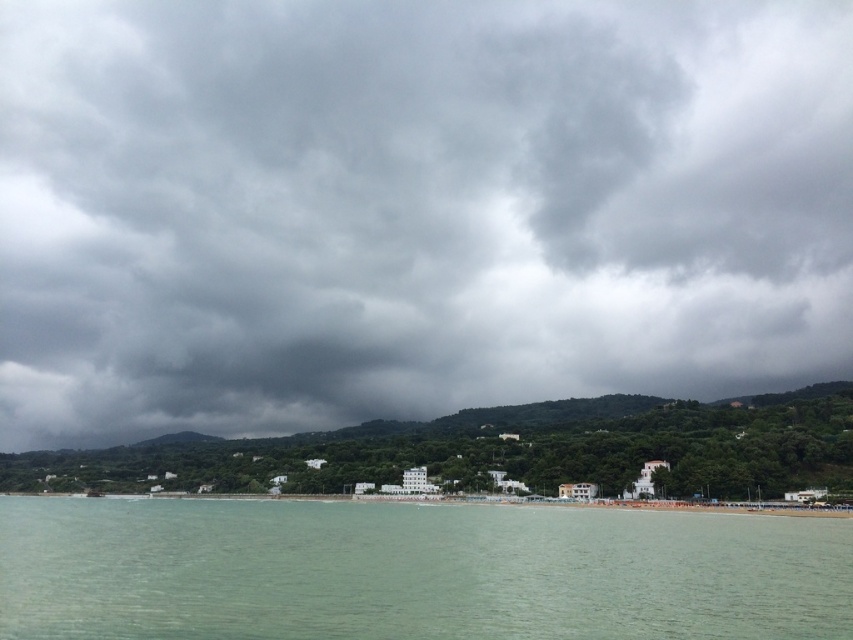
Question: Where is dark gray cloud at upper center located in relation to clear water at lower center in the image?

Choices:
 (A) above
 (B) below

Answer: (A)

Question: Which point is farther to the camera?

Choices:
 (A) clear water at lower center
 (B) dark gray cloud at upper center

Answer: (B)

Question: Does dark gray cloud at upper center appear on the right side of clear water at lower center?

Choices:
 (A) no
 (B) yes

Answer: (A)

Question: Is dark gray cloud at upper center behind clear water at lower center?

Choices:
 (A) yes
 (B) no

Answer: (A)